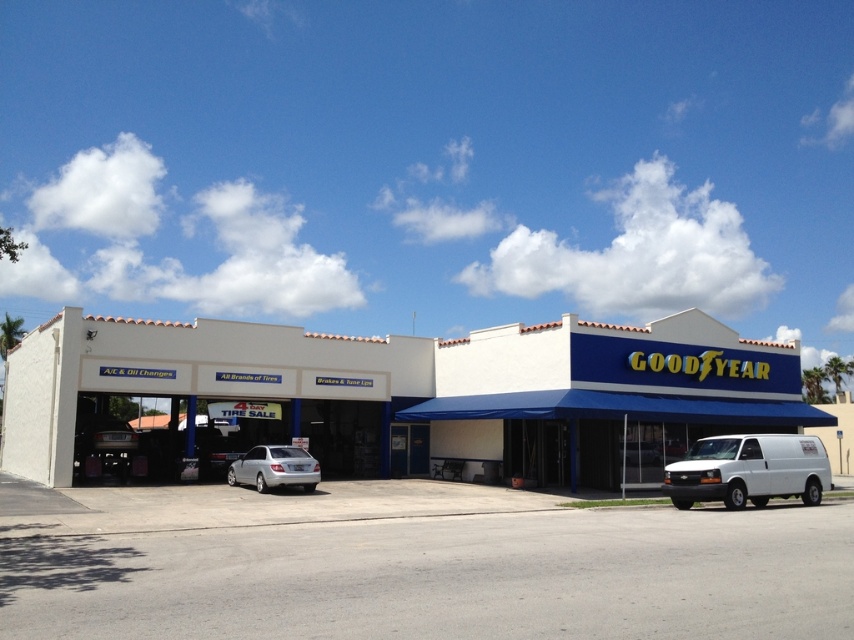
Consider the image. Does white matte van at lower right lie in front of silver metallic sedan at center?

Yes, white matte van at lower right is closer to the viewer.

Can you confirm if white matte van at lower right is bigger than silver metallic sedan at center?

Incorrect, white matte van at lower right is not larger than silver metallic sedan at center.

The height and width of the screenshot is (640, 854). What do you see at coordinates (747, 470) in the screenshot?
I see `white matte van at lower right` at bounding box center [747, 470].

Identify the location of white matte van at lower right. (747, 470).

How much distance is there between gray asphalt parking lot at center and white matte building at center?

gray asphalt parking lot at center and white matte building at center are 9.85 meters apart from each other.

Does gray asphalt parking lot at center appear over white matte building at center?

Actually, gray asphalt parking lot at center is below white matte building at center.

Where is `gray asphalt parking lot at center`? gray asphalt parking lot at center is located at coordinates (412, 564).

Is white matte building at center shorter than silver metallic sedan at center?

No, white matte building at center is not shorter than silver metallic sedan at center.

The height and width of the screenshot is (640, 854). What are the coordinates of `white matte building at center` in the screenshot? It's located at (412, 392).